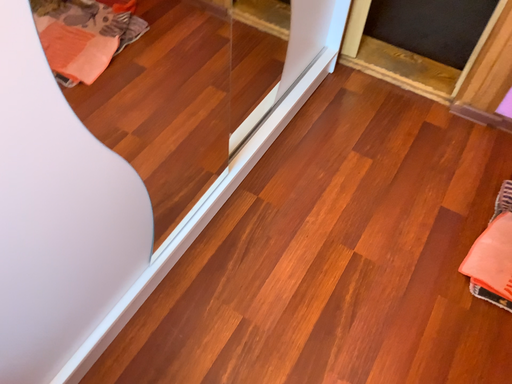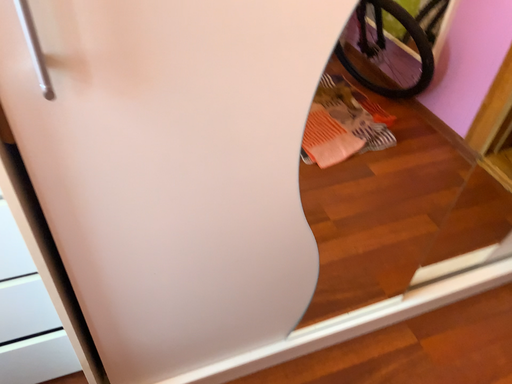
Question: Which way did the camera rotate in the video?

Choices:
 (A) rotated downward
 (B) rotated upward

Answer: (B)